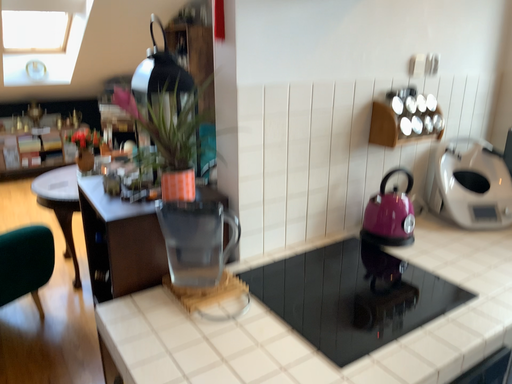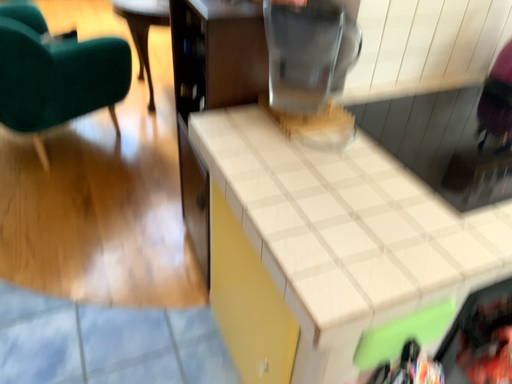
Question: How did the camera likely rotate when shooting the video?

Choices:
 (A) rotated right
 (B) rotated left

Answer: (B)